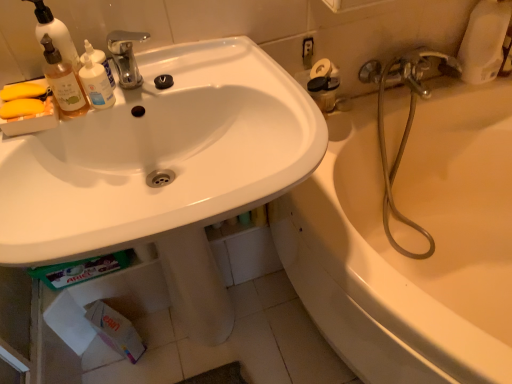
Question: Does metallic hose at right, acting as the second plumbing fixture starting from the back, come in front of translucent plastic bottle at upper left?

Choices:
 (A) no
 (B) yes

Answer: (A)

Question: Is the position of metallic hose at right, acting as the second plumbing fixture starting from the back, more distant than that of translucent plastic bottle at upper left?

Choices:
 (A) no
 (B) yes

Answer: (B)

Question: Is metallic hose at right, acting as the second plumbing fixture starting from the back, located outside translucent plastic bottle at upper left?

Choices:
 (A) no
 (B) yes

Answer: (B)

Question: From the image's perspective, is metallic hose at right, the first plumbing fixture viewed from the front, on translucent plastic bottle at upper left?

Choices:
 (A) no
 (B) yes

Answer: (A)

Question: Does metallic hose at right, acting as the second plumbing fixture starting from the back, have a greater width compared to translucent plastic bottle at upper left?

Choices:
 (A) yes
 (B) no

Answer: (A)

Question: From a real-world perspective, is metallic hose at right, acting as the second plumbing fixture starting from the back, positioned under translucent plastic bottle at upper left based on gravity?

Choices:
 (A) no
 (B) yes

Answer: (B)

Question: Are white matte soap dispenser at upper left and translucent plastic bottle at upper left making contact?

Choices:
 (A) yes
 (B) no

Answer: (A)

Question: From the image's perspective, is white matte soap dispenser at upper left above translucent plastic bottle at upper left?

Choices:
 (A) yes
 (B) no

Answer: (A)

Question: From the image's perspective, is white matte soap dispenser at upper left beneath translucent plastic bottle at upper left?

Choices:
 (A) no
 (B) yes

Answer: (A)

Question: Can you confirm if white matte soap dispenser at upper left is thinner than translucent plastic bottle at upper left?

Choices:
 (A) no
 (B) yes

Answer: (B)

Question: Is white matte soap dispenser at upper left located outside translucent plastic bottle at upper left?

Choices:
 (A) yes
 (B) no

Answer: (A)

Question: Is white matte soap dispenser at upper left bigger than translucent plastic bottle at upper left?

Choices:
 (A) yes
 (B) no

Answer: (A)

Question: Is translucent plastic bottle at upper left shorter than metallic hose at right, the first plumbing fixture viewed from the front?

Choices:
 (A) no
 (B) yes

Answer: (B)